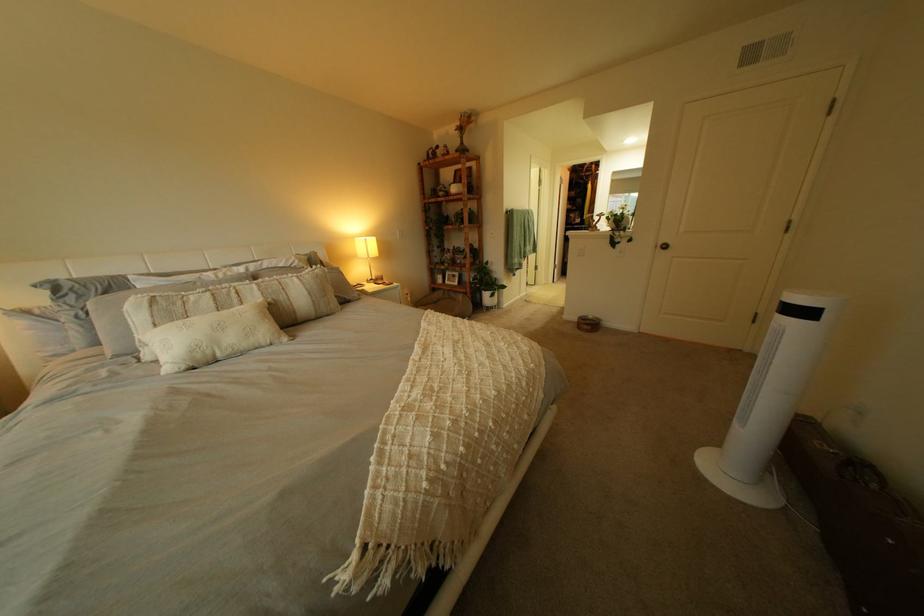
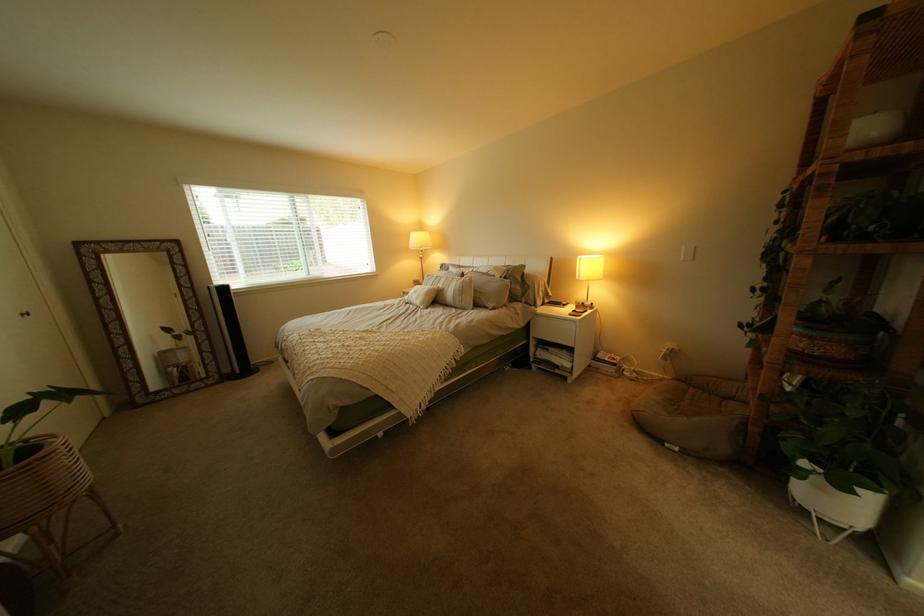
Locate, in the second image, the point that corresponds to (298,299) in the first image.

(462, 290)